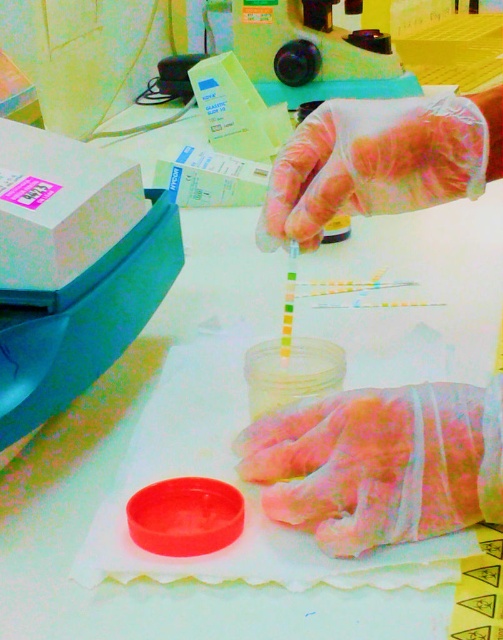
Question: In this image, where is matte plastic box at left located relative to pink latex glove at center?

Choices:
 (A) right
 (B) left

Answer: (B)

Question: Estimate the real-world distances between objects in this image. Which object is closer to the matte plastic box at left?

Choices:
 (A) clear plastic glove at upper center
 (B) pink latex glove at center

Answer: (A)

Question: Which of these objects is positioned closest to the pink latex glove at center?

Choices:
 (A) matte plastic box at left
 (B) clear plastic glove at upper center

Answer: (B)

Question: Can you confirm if pink latex glove at center is positioned above clear plastic glove at upper center?

Choices:
 (A) yes
 (B) no

Answer: (B)

Question: Which point is farther from the camera taking this photo?

Choices:
 (A) (86, 164)
 (B) (407, 426)

Answer: (A)

Question: Where is pink latex glove at center located in relation to clear plastic glove at upper center in the image?

Choices:
 (A) below
 (B) above

Answer: (A)